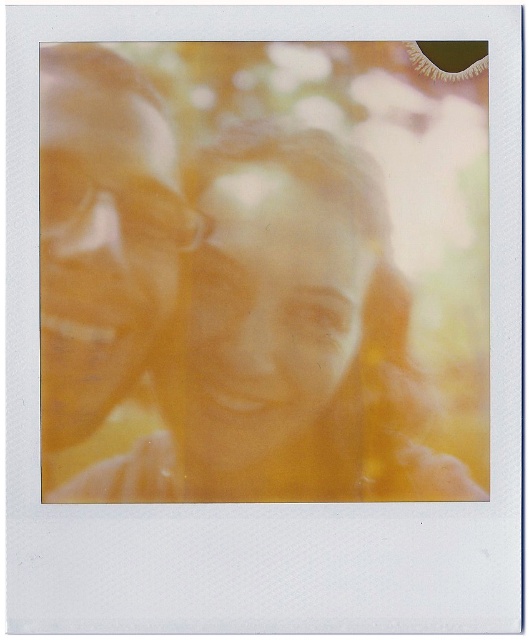
Question: Which point is closer to the camera?

Choices:
 (A) smooth skin face at center
 (B) matte yellow hair at center
 (C) matte orange face at center

Answer: (B)

Question: Is smooth skin face at center wider than matte orange face at center?

Choices:
 (A) yes
 (B) no

Answer: (A)

Question: Among these points, which one is farthest from the camera?

Choices:
 (A) (355, 240)
 (B) (148, 180)
 (C) (441, 380)

Answer: (C)

Question: Is matte yellow hair at center closer to the viewer compared to smooth skin face at center?

Choices:
 (A) yes
 (B) no

Answer: (A)

Question: Which point is farther from the camera taking this photo?

Choices:
 (A) (71, 179)
 (B) (105, 300)

Answer: (B)

Question: Where is smooth skin face at center located in relation to matte orange face at center in the image?

Choices:
 (A) below
 (B) above

Answer: (A)